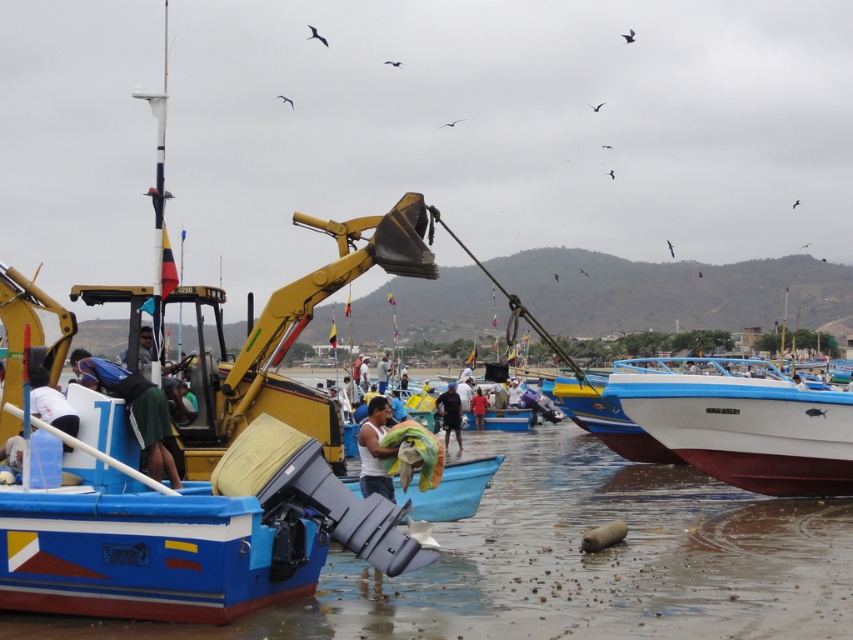
Is white glossy boat at right shorter than light blue fabric at center?

No, white glossy boat at right is not shorter than light blue fabric at center.

Who is positioned more to the right, white glossy boat at right or light blue fabric at center?

Positioned to the right is white glossy boat at right.

Between point (660, 422) and point (138, 368), which one is positioned in front?

Point (138, 368) is in front.

At what (x,y) coordinates should I click in order to perform the action: click on white glossy boat at right. Please return your answer as a coordinate pair (x, y). The image size is (853, 640). Looking at the image, I should click on (741, 422).

Which is above, blue fabric bag at center or light blue fabric at center?

blue fabric bag at center is above.

Can you confirm if blue fabric bag at center is bigger than light blue fabric at center?

No, blue fabric bag at center is not bigger than light blue fabric at center.

Between point (77, 372) and point (143, 358), which one is positioned behind?

Point (143, 358)

I want to click on blue fabric bag at center, so click(135, 410).

Based on the photo, can you confirm if white matte tank top at center is positioned to the left of red fabric person at center?

Indeed, white matte tank top at center is positioned on the left side of red fabric person at center.

Is point (361, 454) farther from camera compared to point (469, 403)?

No, (361, 454) is in front of (469, 403).

Image resolution: width=853 pixels, height=640 pixels. I want to click on white matte tank top at center, so click(x=374, y=451).